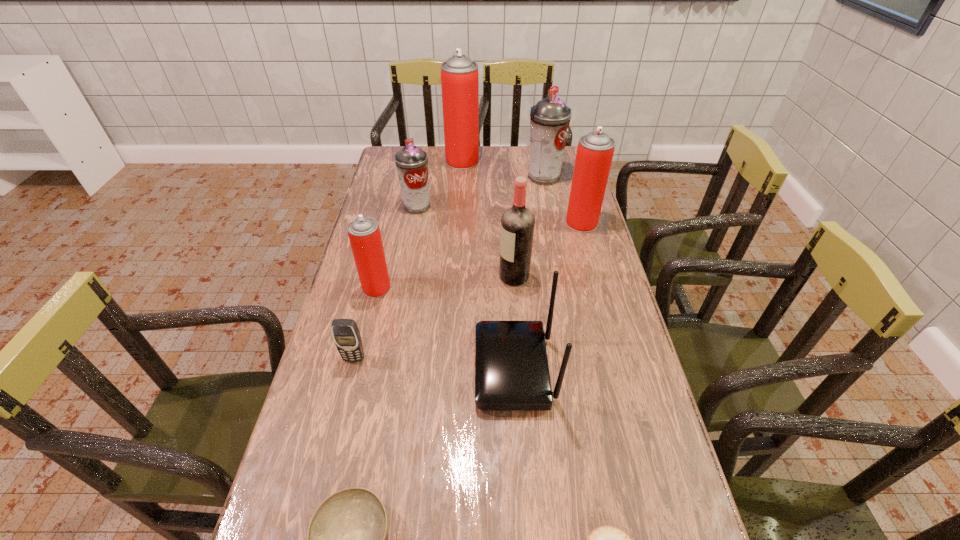
Where is `red aerosol can that stands as the second closest to the smallest red aerosol can`? This screenshot has height=540, width=960. red aerosol can that stands as the second closest to the smallest red aerosol can is located at coordinates (459, 74).

The image size is (960, 540). I want to click on vacant point that satisfies the following two spatial constraints: 1. on the back side of the farther gray aerosol can; 2. on the left side of the nearer gray aerosol can, so click(422, 177).

At what (x,y) coordinates should I click in order to perform the action: click on free spot that satisfies the following two spatial constraints: 1. on the front-facing side of the liquor; 2. on the front face of the cellular telephone. Please return your answer as a coordinate pair (x, y). The width and height of the screenshot is (960, 540). Looking at the image, I should click on (520, 358).

This screenshot has width=960, height=540. What are the coordinates of `vacant point that satisfies the following two spatial constraints: 1. on the front side of the second nearest red aerosol can; 2. on the right side of the right gray aerosol can` in the screenshot? It's located at (553, 223).